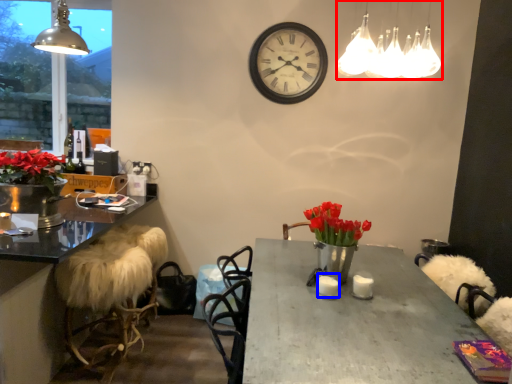
Question: Which object appears closest to the camera in this image, lamp (highlighted by a red box) or candle (highlighted by a blue box)?

Choices:
 (A) lamp
 (B) candle

Answer: (A)